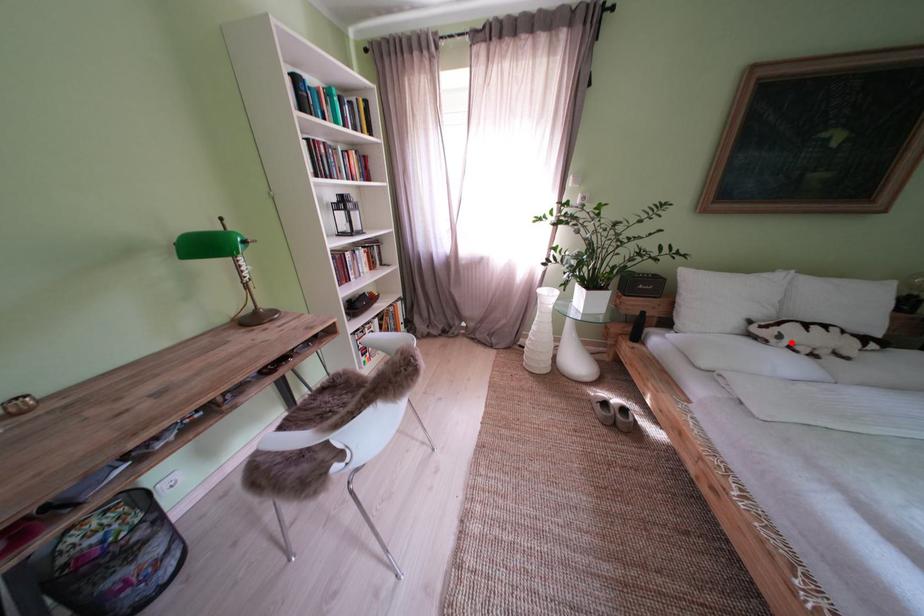
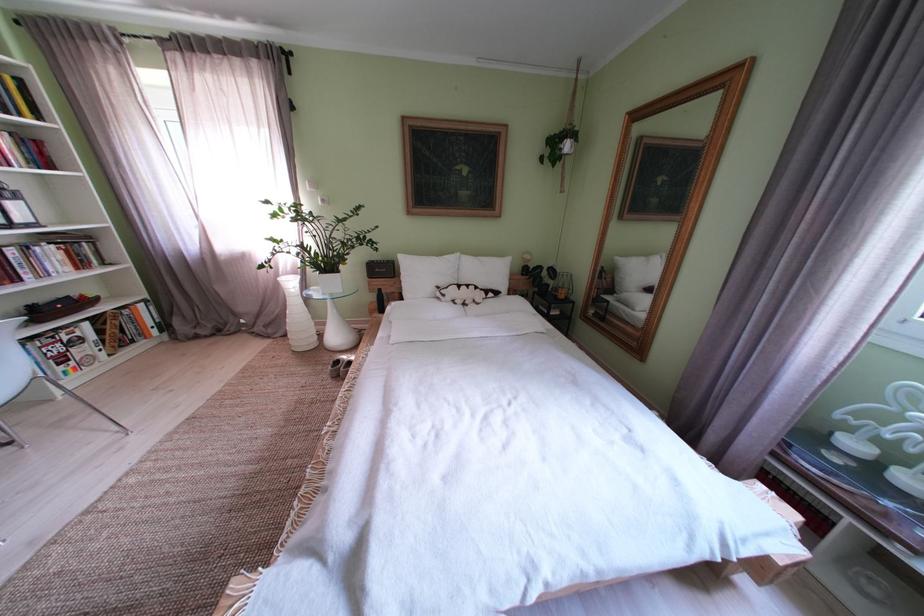
Where in the second image is the point corresponding to the highlighted location from the first image?

(455, 301)